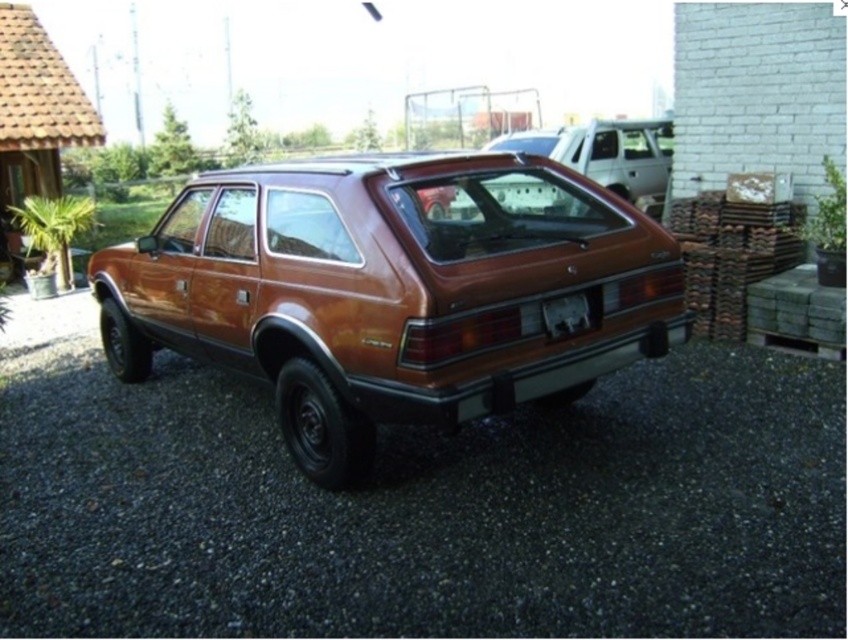
You are standing at the position of the station wagon and want to walk to the point labeled point [120,346]. Which direction should you move relative to the other point labeled point [307,573]?

You should move towards the point labeled point [120,346], which is behind the point labeled point [307,573].